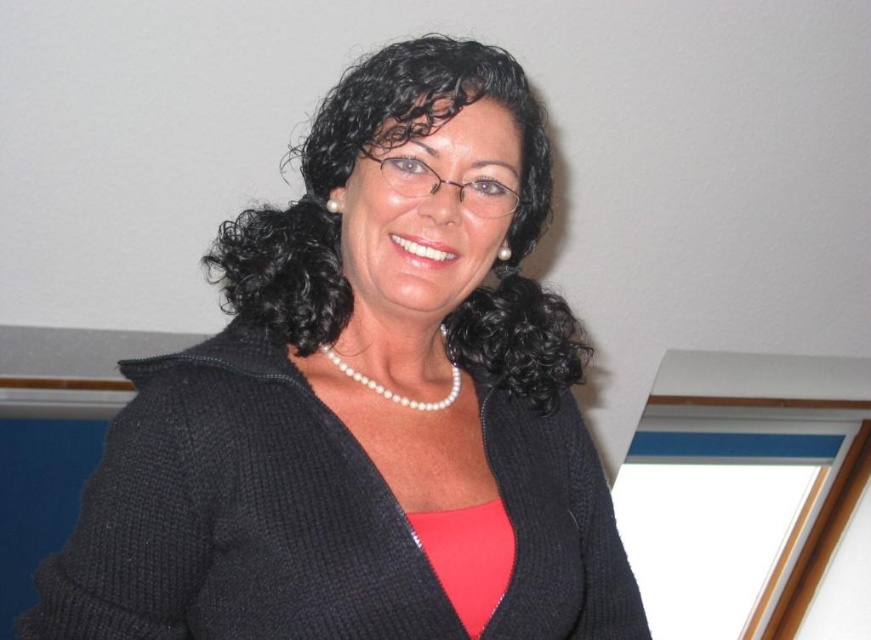
Question: Which point is farther from the camera taking this photo?

Choices:
 (A) (523, 474)
 (B) (417, 401)
 (C) (449, 339)

Answer: (C)

Question: Is black knitted sweater at center below pearl necklace at center?

Choices:
 (A) yes
 (B) no

Answer: (B)

Question: In this image, where is black curly hair at center located relative to pearl necklace at center?

Choices:
 (A) left
 (B) right

Answer: (A)

Question: Which point appears farthest from the camera in this image?

Choices:
 (A) (429, 129)
 (B) (156, 378)

Answer: (B)

Question: Which point appears closest to the camera in this image?

Choices:
 (A) (436, 401)
 (B) (192, 372)
 (C) (532, 390)

Answer: (B)

Question: Is black curly hair at center closer to the viewer compared to pearl necklace at center?

Choices:
 (A) yes
 (B) no

Answer: (A)